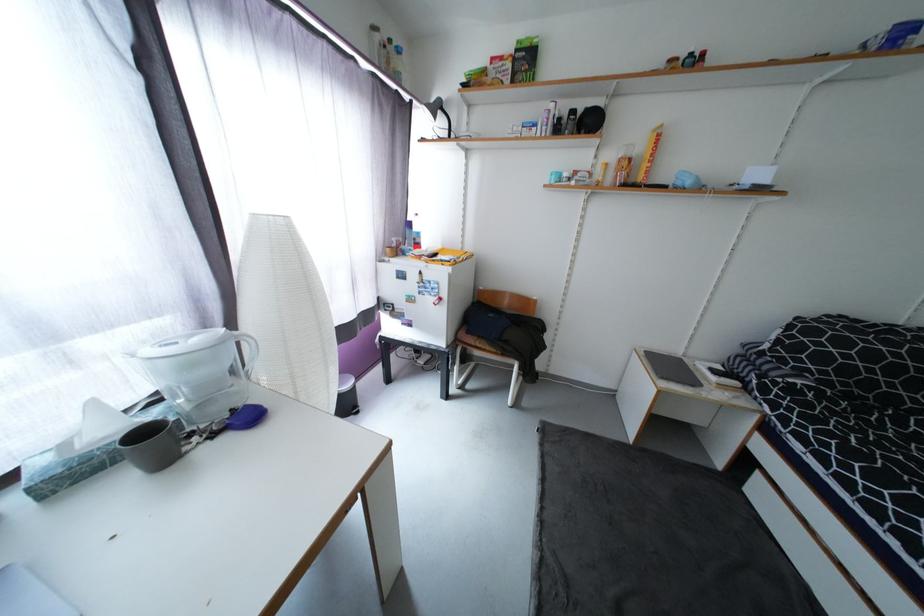
The height and width of the screenshot is (616, 924). I want to click on green snack box, so click(525, 60).